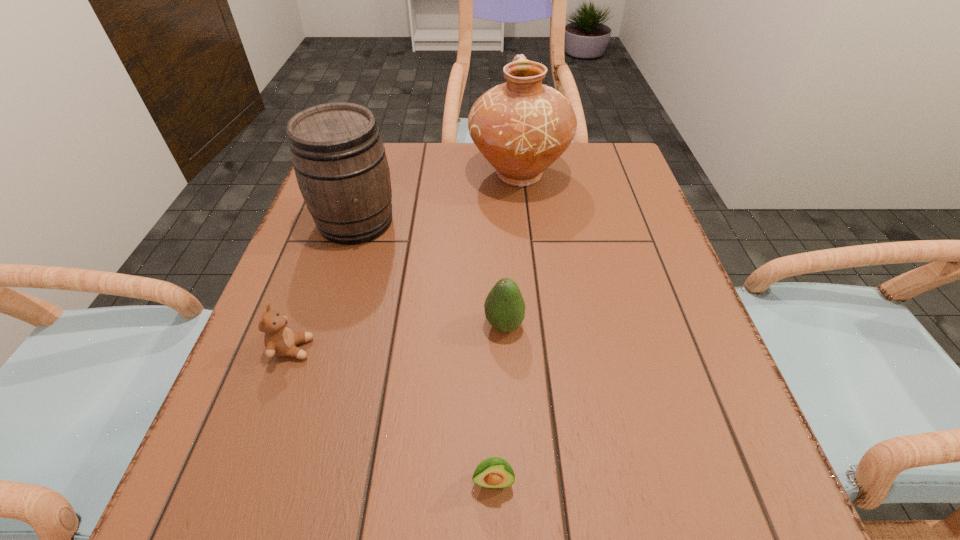
Find the location of a particular element. pottery is located at coordinates (521, 127).

The width and height of the screenshot is (960, 540). In order to click on wine bucket in this screenshot , I will do `click(339, 159)`.

You are a GUI agent. You are given a task and a screenshot of the screen. Output one action in this format:
    pyautogui.click(x=<x>, y=<y>)
    Task: Click on the taller avocado
    
    Given the screenshot: What is the action you would take?
    pyautogui.click(x=504, y=306)

At what (x,y) coordinates should I click in order to perform the action: click on teddy bear. Please return your answer as a coordinate pair (x, y). Image resolution: width=960 pixels, height=540 pixels. Looking at the image, I should click on (279, 339).

This screenshot has width=960, height=540. In order to click on the nearer avocado in this screenshot , I will do `click(493, 472)`.

Find the location of a particular element. the nearest object is located at coordinates (493, 472).

In order to click on free space located 0.140m on the front of the wine bucket in this screenshot , I will do `click(332, 299)`.

This screenshot has width=960, height=540. In order to click on free space located 0.220m on the back of the taller avocado in this screenshot , I will do `click(499, 233)`.

Find the location of `free space located 0.370m on the front-facing side of the teddy bear`. free space located 0.370m on the front-facing side of the teddy bear is located at coordinates (527, 349).

Where is `object present at the far edge`? The width and height of the screenshot is (960, 540). object present at the far edge is located at coordinates (521, 127).